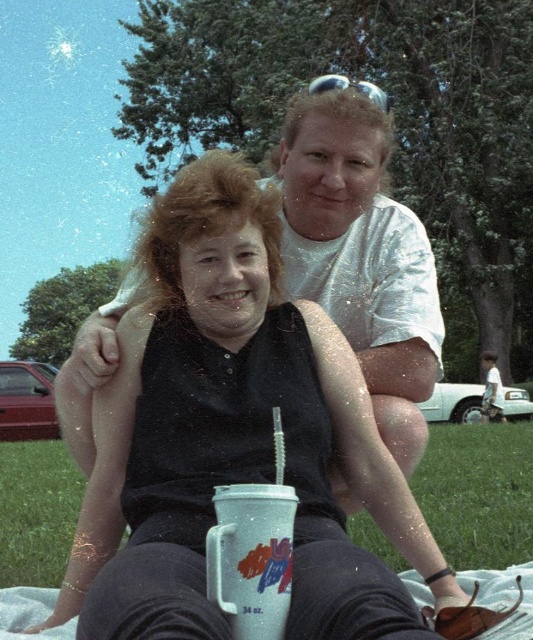
Between point (513, 465) and point (217, 541), which one is positioned in front?

Point (217, 541) is in front.

Is green grass at lower center smaller than white plastic mug at center?

No, green grass at lower center is not smaller than white plastic mug at center.

This screenshot has width=533, height=640. In order to click on green grass at lower center in this screenshot , I will do `click(479, 492)`.